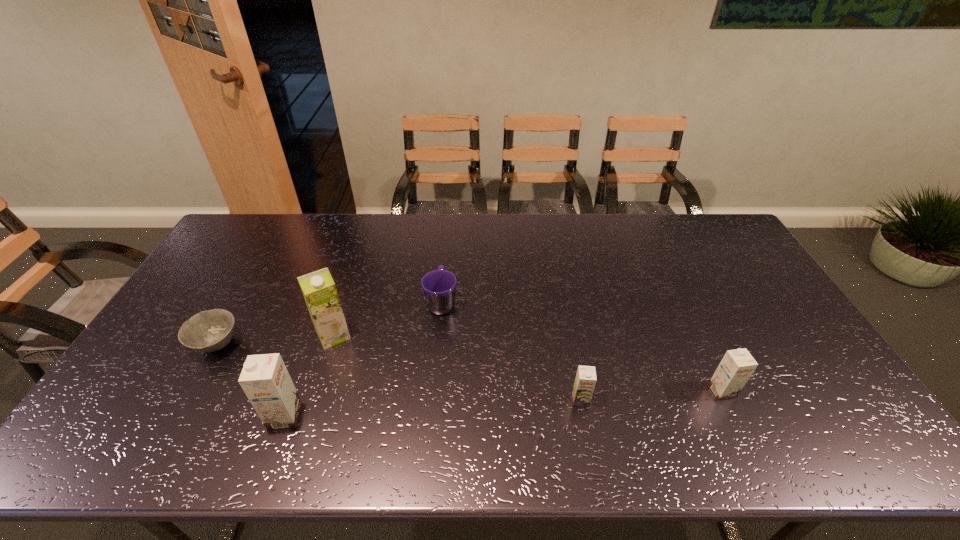
Locate an element on the screen. The image size is (960, 540). vacant space at the near edge of the desktop is located at coordinates (688, 390).

Locate an element on the screen. This screenshot has width=960, height=540. free point at the left edge is located at coordinates (192, 308).

Image resolution: width=960 pixels, height=540 pixels. I want to click on vacant space at the far left corner of the desktop, so click(269, 232).

Locate an element on the screen. This screenshot has height=540, width=960. free space at the near left corner of the desktop is located at coordinates (156, 395).

Locate an element on the screen. free space at the far right corner is located at coordinates (731, 252).

The width and height of the screenshot is (960, 540). I want to click on vacant area that lies between the fourth object from left to right and the fourth shortest object, so click(582, 347).

Where is `free space between the soya milk and the bowl`? The width and height of the screenshot is (960, 540). free space between the soya milk and the bowl is located at coordinates (276, 340).

This screenshot has width=960, height=540. I want to click on empty location between the mug and the soya milk, so [388, 319].

What are the coordinates of `free area in between the third tallest object and the second chocolate milk from right to left` in the screenshot? It's located at (651, 395).

The height and width of the screenshot is (540, 960). What are the coordinates of `free space between the second shortest chocolate milk and the shortest chocolate milk` in the screenshot? It's located at pos(651,395).